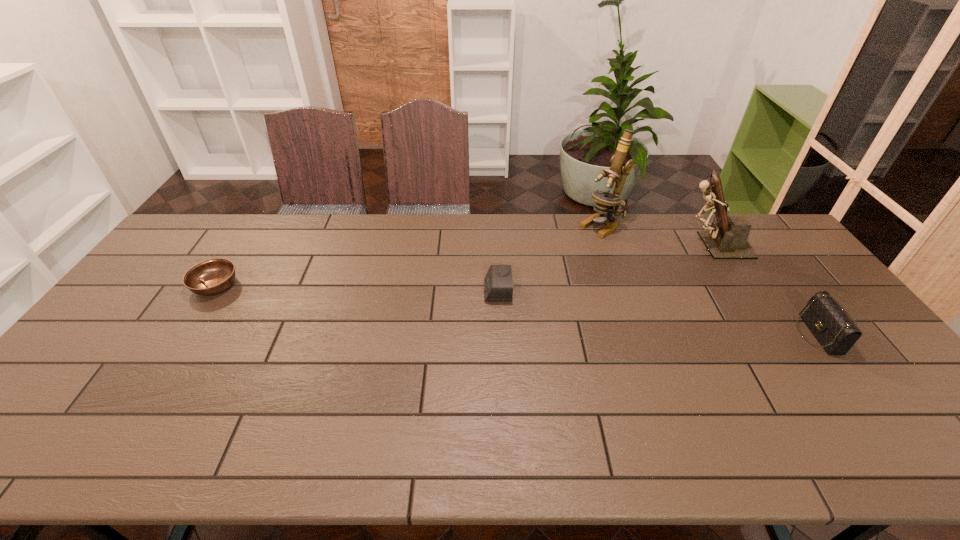
You are a GUI agent. You are given a task and a screenshot of the screen. Output one action in this format:
    pyautogui.click(x=<x>, y=<y>)
    Task: Click on the microscope that is at the far edge
    The height and width of the screenshot is (540, 960).
    Given the screenshot: What is the action you would take?
    pyautogui.click(x=606, y=202)

Image resolution: width=960 pixels, height=540 pixels. I want to click on figurine that is positioned at the far edge, so pos(727,238).

Locate an element on the screen. The height and width of the screenshot is (540, 960). object that is at the left edge is located at coordinates (212, 276).

Identify the location of figurine positioned at the right edge. click(727, 238).

In order to click on clutch bag that is at the right edge in this screenshot , I will do `click(835, 331)`.

This screenshot has height=540, width=960. I want to click on object present at the far right corner, so click(x=727, y=238).

Image resolution: width=960 pixels, height=540 pixels. In the image, there is a desktop. Identify the location of vacant space at the far edge. (713, 214).

Locate an element on the screen. The width and height of the screenshot is (960, 540). free space at the near edge is located at coordinates click(x=182, y=453).

Find the location of `vacant space at the left edge of the desktop`. vacant space at the left edge of the desktop is located at coordinates (177, 307).

This screenshot has width=960, height=540. I want to click on free space at the far right corner, so click(x=777, y=234).